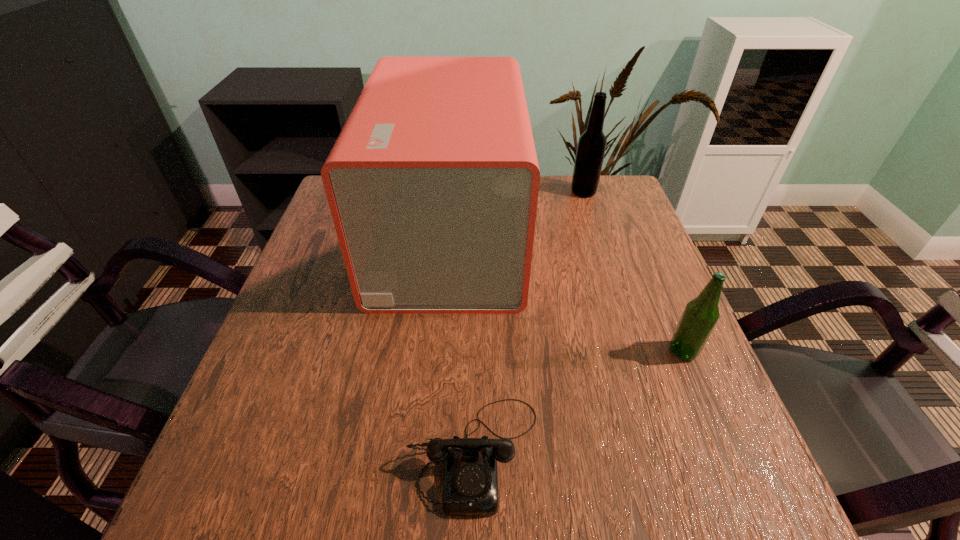
This screenshot has height=540, width=960. I want to click on free spot located on the label of the nearer beer bottle, so click(634, 351).

This screenshot has height=540, width=960. What are the coordinates of `vacant area located on the label of the nearer beer bottle` in the screenshot? It's located at (612, 351).

Find the location of a particular element. box at the far edge is located at coordinates (433, 182).

Where is `beer bottle that is positioned at the far edge`? beer bottle that is positioned at the far edge is located at coordinates (591, 147).

You are a GUI agent. You are given a task and a screenshot of the screen. Output one action in this format:
    pyautogui.click(x=<x>, y=<y>)
    Task: Click on the object present at the near edge
    
    Given the screenshot: What is the action you would take?
    pyautogui.click(x=470, y=488)

Image resolution: width=960 pixels, height=540 pixels. What are the coordinates of `object present at the left edge` in the screenshot? It's located at (433, 182).

The width and height of the screenshot is (960, 540). In order to click on object that is at the far left corner in this screenshot , I will do `click(433, 182)`.

Where is `object that is at the far right corner`? The height and width of the screenshot is (540, 960). object that is at the far right corner is located at coordinates click(591, 147).

Where is `vacant space at the far edge of the desktop`? vacant space at the far edge of the desktop is located at coordinates (544, 187).

In the image, there is a desktop. At what (x,y) coordinates should I click in order to perform the action: click on vacant area at the near edge. Please return your answer as a coordinate pair (x, y). The height and width of the screenshot is (540, 960). Looking at the image, I should click on (630, 465).